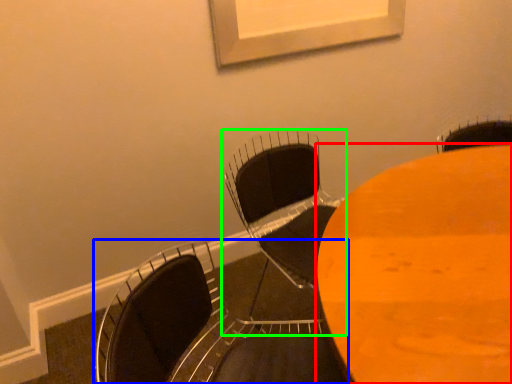
Question: Considering the real-world distances, which object is closest to table (highlighted by a red box)? chair (highlighted by a blue box) or chair (highlighted by a green box).

Choices:
 (A) chair
 (B) chair

Answer: (A)